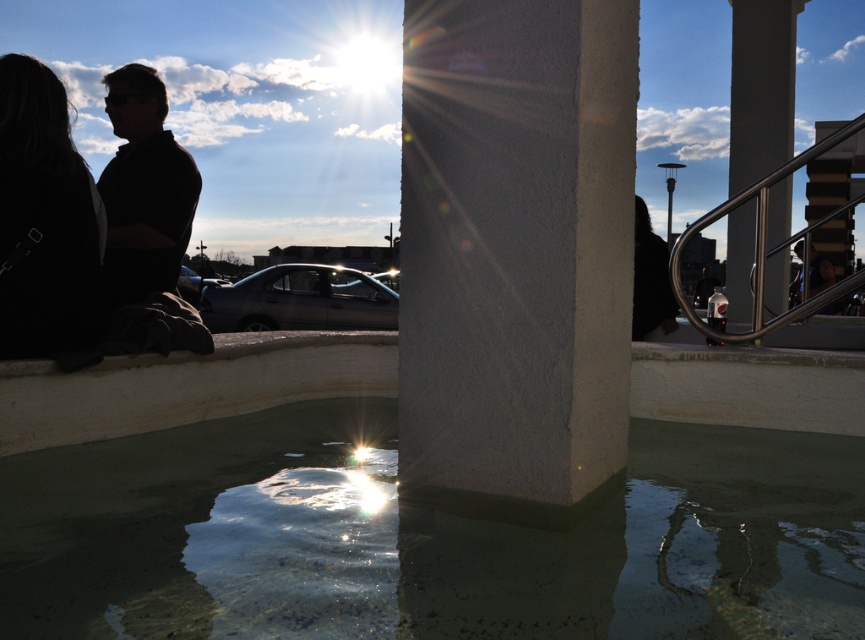
Question: Is smooth concrete pillar at upper right further to the viewer compared to satin silver railing at upper right?

Choices:
 (A) no
 (B) yes

Answer: (B)

Question: Which object is positioned farthest from the white smooth ledge at lower center?

Choices:
 (A) clear concrete water at center
 (B) silhouette clothing at left
 (C) smooth concrete pillar at upper right

Answer: (C)

Question: Is white smooth ledge at lower center to the left of smooth concrete pillar at upper right from the viewer's perspective?

Choices:
 (A) no
 (B) yes

Answer: (B)

Question: Can you confirm if white smooth ledge at lower center is bigger than smooth concrete pillar at upper right?

Choices:
 (A) yes
 (B) no

Answer: (B)

Question: Among these objects, which one is nearest to the camera?

Choices:
 (A) satin silver railing at upper right
 (B) white smooth ledge at lower center

Answer: (B)

Question: Which is farther from the satin silver railing at upper right?

Choices:
 (A) silhouette clothing at left
 (B) smooth concrete pillar at upper right
 (C) clear concrete water at center

Answer: (B)